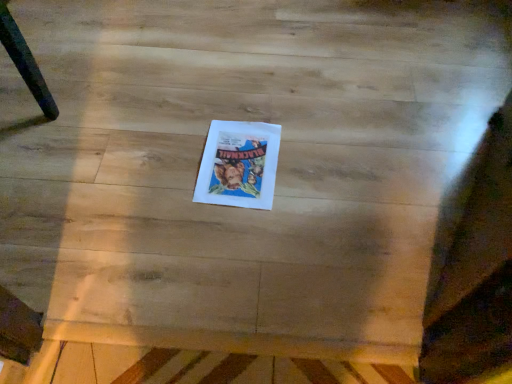
Where is `free space above white paper at center (from a real-world perspective)`? This screenshot has height=384, width=512. free space above white paper at center (from a real-world perspective) is located at coordinates point(246,149).